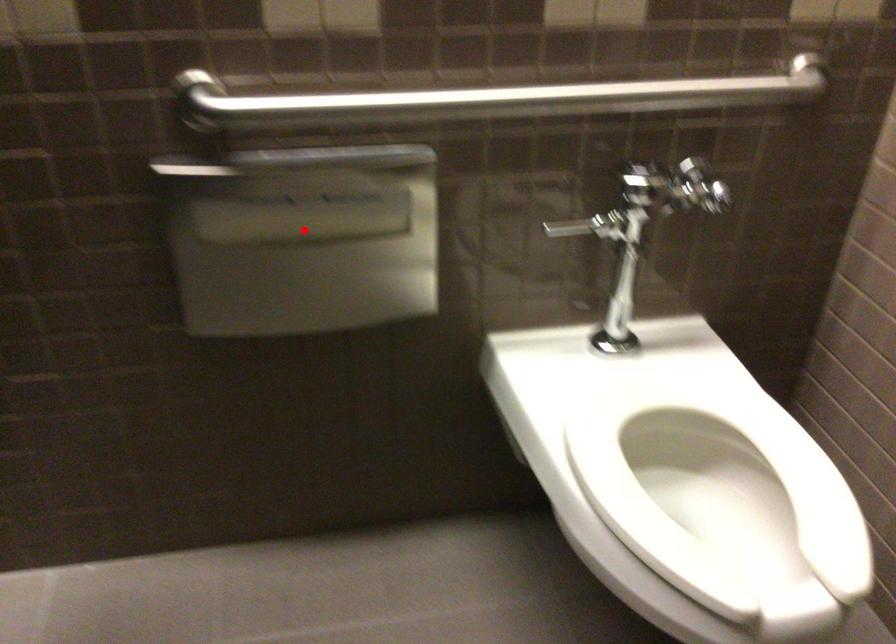
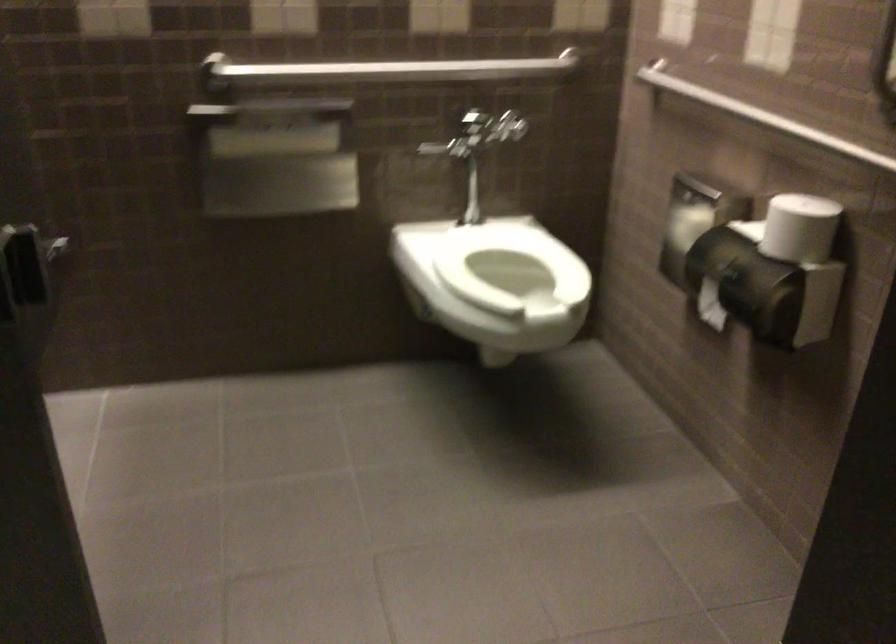
Question: I am providing you with two images of the same scene from different viewpoints. In image1, a red point is highlighted. Considering the same 3D point in image2, which of the following is correct?

Choices:
 (A) It is closer
 (B) It is farther

Answer: (B)